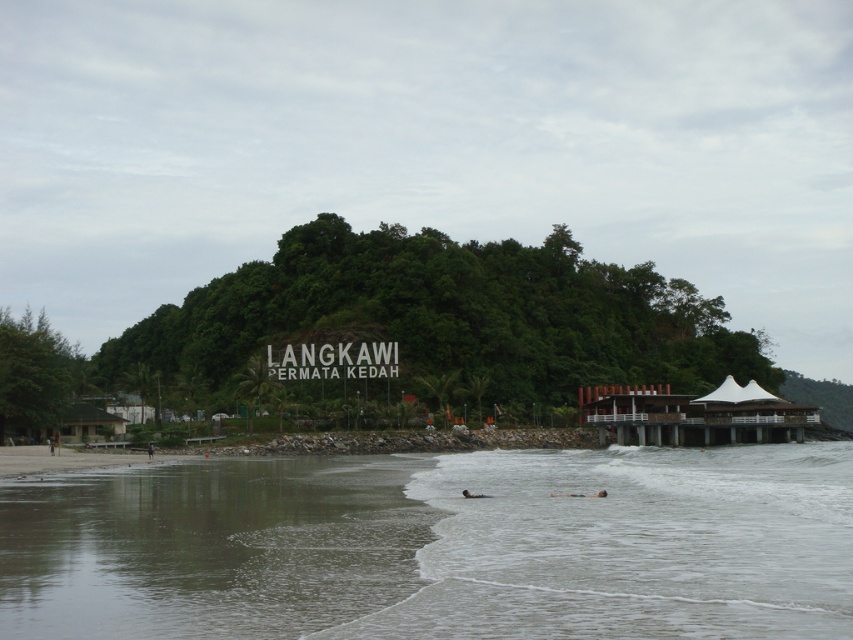
Question: Which point appears farthest from the camera in this image?

Choices:
 (A) (677, 628)
 (B) (310, 620)

Answer: (B)

Question: Can you confirm if clear water at center is positioned to the left of clear water at lower left?

Choices:
 (A) yes
 (B) no

Answer: (B)

Question: Is clear water at center positioned before clear water at lower left?

Choices:
 (A) no
 (B) yes

Answer: (B)

Question: Considering the relative positions of clear water at center and clear water at lower left in the image provided, where is clear water at center located with respect to clear water at lower left?

Choices:
 (A) below
 (B) above

Answer: (A)

Question: Among these objects, which one is nearest to the camera?

Choices:
 (A) clear water at lower left
 (B) clear water at center

Answer: (B)

Question: Which of the following is the farthest from the observer?

Choices:
 (A) (834, 540)
 (B) (62, 621)

Answer: (A)